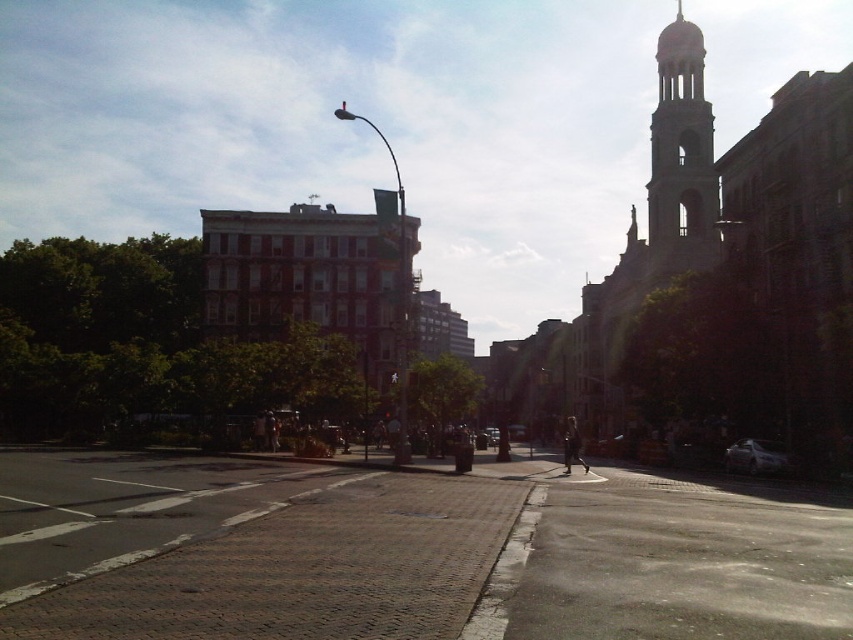
Question: Which point appears closest to the camera in this image?

Choices:
 (A) (694, 243)
 (B) (757, 458)

Answer: (B)

Question: Does gray stone tower at upper right appear over metallic silver car at center?

Choices:
 (A) no
 (B) yes

Answer: (B)

Question: Can you confirm if satin silver sedan at lower right is positioned above metallic silver car at center?

Choices:
 (A) yes
 (B) no

Answer: (A)

Question: Among these points, which one is nearest to the camera?

Choices:
 (A) (733, 458)
 (B) (491, 440)

Answer: (A)

Question: Can you confirm if satin silver sedan at lower right is positioned to the right of metallic silver car at center?

Choices:
 (A) no
 (B) yes

Answer: (B)

Question: Which of the following is the farthest from the observer?

Choices:
 (A) gray stone tower at upper right
 (B) satin silver sedan at lower right
 (C) metallic silver car at center

Answer: (A)